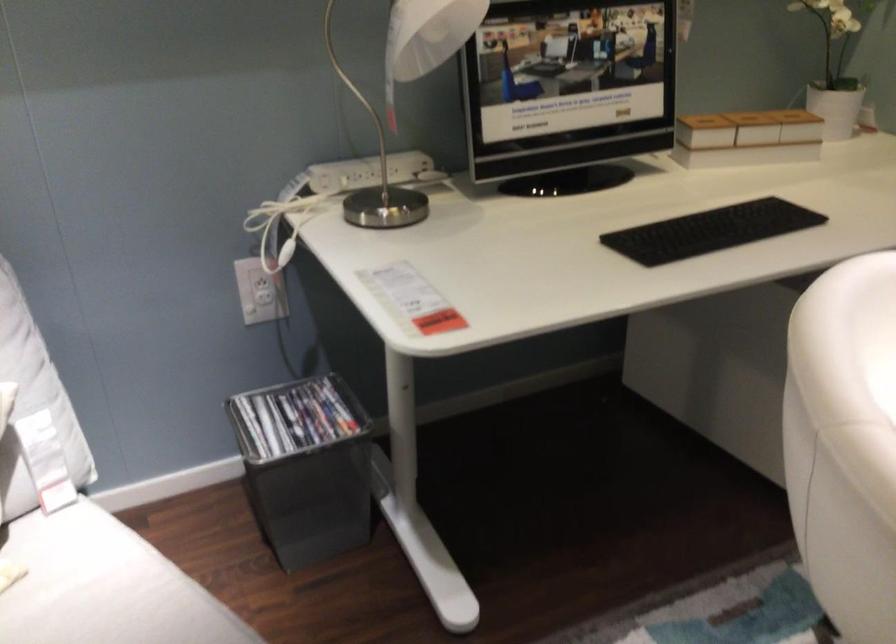
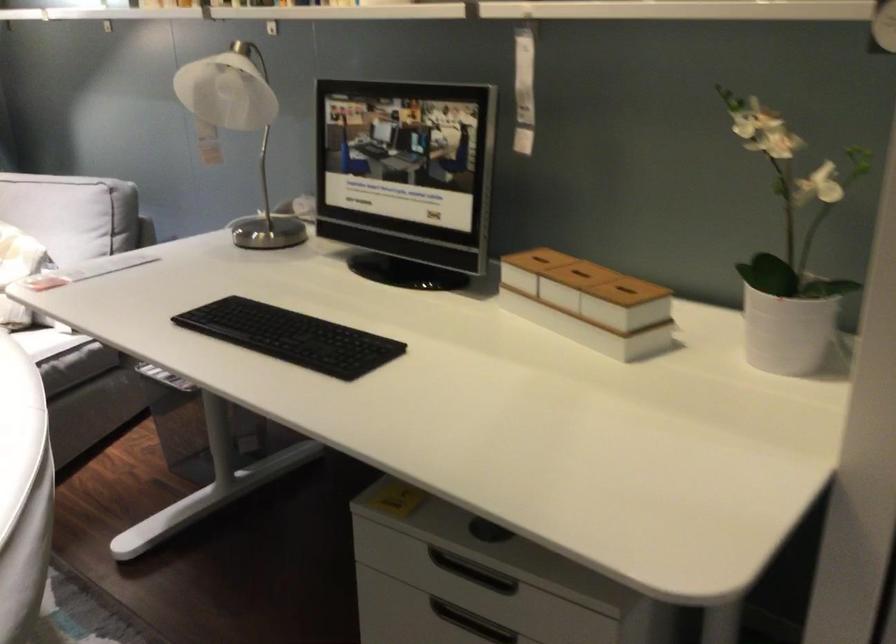
Where in the second image is the point corresponding to (821,109) from the first image?

(627, 290)